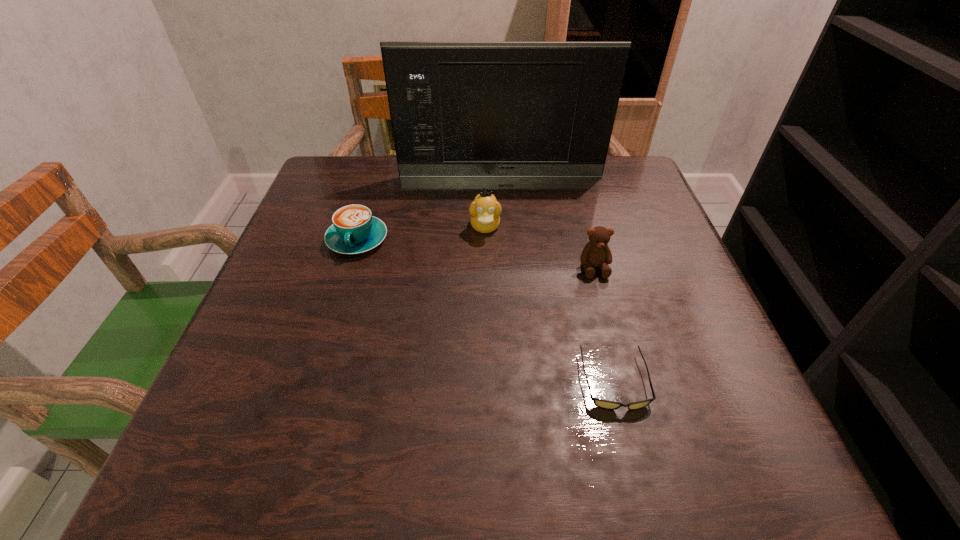
Where is `vacant space at the left edge`? Image resolution: width=960 pixels, height=540 pixels. vacant space at the left edge is located at coordinates [x=286, y=307].

This screenshot has height=540, width=960. Identify the location of blank space at the right edge of the desktop. (733, 376).

Image resolution: width=960 pixels, height=540 pixels. In the image, there is a desktop. In order to click on free space at the far left corner in this screenshot , I will do `click(368, 206)`.

Locate an element on the screen. The image size is (960, 540). vacant space at the far right corner of the desktop is located at coordinates (637, 193).

You are a GUI agent. You are given a task and a screenshot of the screen. Output one action in this format:
    pyautogui.click(x=<x>, y=<y>)
    Task: Click on the unoccupied area between the sunglasses and the farthest object
    Image resolution: width=960 pixels, height=540 pixels.
    Given the screenshot: What is the action you would take?
    click(558, 279)

Locate an element on the screen. Image resolution: width=960 pixels, height=540 pixels. free space between the farthest object and the cappuccino is located at coordinates (429, 208).

Locate an element on the screen. The height and width of the screenshot is (540, 960). vacant region between the tallest object and the teddy bear is located at coordinates (547, 222).

Where is `blank region between the teddy bear and the duckling`? This screenshot has width=960, height=540. blank region between the teddy bear and the duckling is located at coordinates (540, 247).

What are the coordinates of `free point between the nearest object and the teddy bear` in the screenshot? It's located at (604, 325).

You are a GUI agent. You are given a task and a screenshot of the screen. Output one action in this format:
    pyautogui.click(x=<x>, y=<y>)
    Task: Click on the empty location between the duckling and the teddy bear
    
    Given the screenshot: What is the action you would take?
    [540, 247]